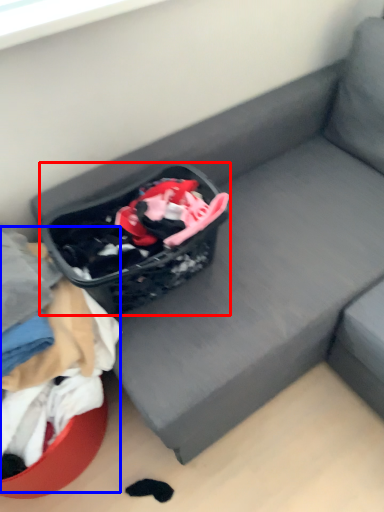
Question: Which object is further to the camera taking this photo, shopping basket (highlighted by a red box) or clothing (highlighted by a blue box)?

Choices:
 (A) shopping basket
 (B) clothing

Answer: (A)